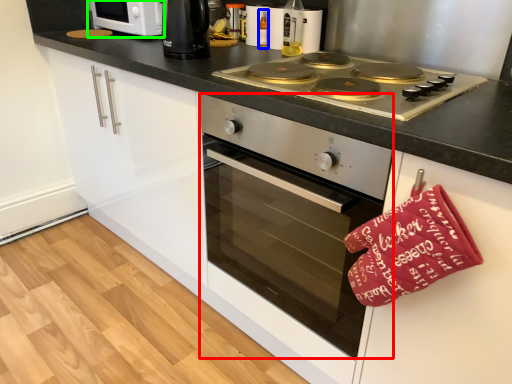
Question: Estimate the real-world distances between objects in this image. Which object is farther from oven (highlighted by a red box), bottle (highlighted by a blue box) or home appliance (highlighted by a green box)?

Choices:
 (A) bottle
 (B) home appliance

Answer: (B)